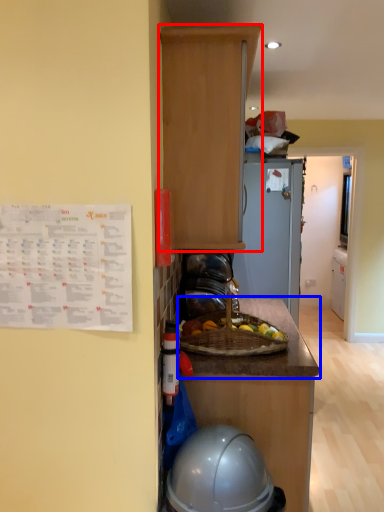
Question: Among these objects, which one is farthest to the camera, cabinetry (highlighted by a red box) or countertop (highlighted by a blue box)?

Choices:
 (A) cabinetry
 (B) countertop

Answer: (B)